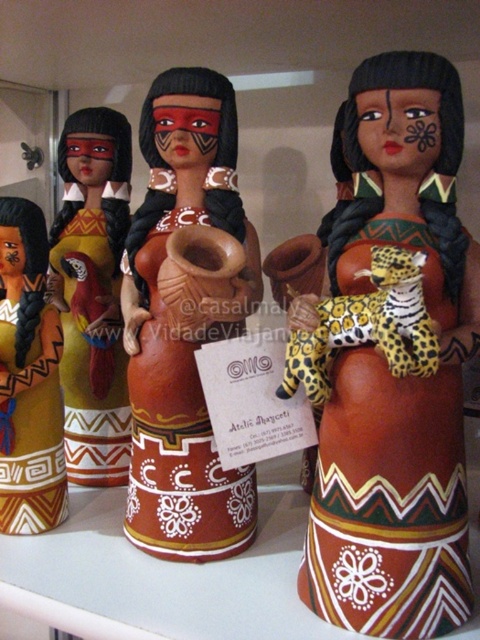
Is matte clay doll at center closer to camera compared to matte clay figurine at center?

That is False.

Between matte clay doll at center and matte clay figurine at center, which one is positioned higher?

matte clay doll at center is above.

Does point (84, 365) come in front of point (35, 220)?

No, it is not.

Locate an element on the screen. The width and height of the screenshot is (480, 640). matte clay doll at center is located at coordinates (93, 292).

Which is below, matte clay figure at center or matte clay doll at center?

matte clay figure at center

Locate an element on the screen. The width and height of the screenshot is (480, 640). matte clay figure at center is located at coordinates (388, 371).

I want to click on matte clay figure at center, so [x=388, y=371].

Is matte clay figure at center closer to camera compared to terracotta figure at center?

Yes, matte clay figure at center is in front of terracotta figure at center.

Which is below, matte clay figure at center or terracotta figure at center?

matte clay figure at center is below.

Is point (311, 307) less distant than point (124, 328)?

Yes, point (311, 307) is closer to viewer.

Image resolution: width=480 pixels, height=640 pixels. In order to click on matte clay figure at center in this screenshot , I will do `click(388, 371)`.